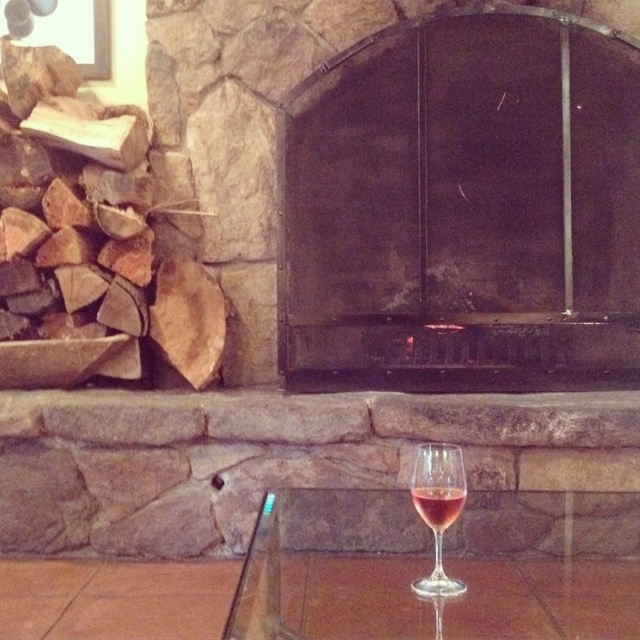
You are sitting at the transparent glass table at lower center and want to place a book on the dark stone fireplace at center. Which direction should you move the book to reach the fireplace?

You should move the book to the right since the dark stone fireplace at center is to the right of the transparent glass table at lower center.

In the scene shown: You are sitting at the transparent glass table at lower center and want to reach the dark stone fireplace at center to place a decorative item. Considering your current position, which direction should you move to reach the fireplace?

Since the transparent glass table at lower center is behind the dark stone fireplace at center, you should move forward to reach the dark stone fireplace at center from your current position.

You are arranging a dinner party and need to place a clear glass wine glass at center on the transparent glass table at lower center. Will the wine glass fit on the table without falling off the edges?

The transparent glass table at lower center is wider than the clear glass wine glass at center, so the wine glass will fit securely on the table without falling off the edges.